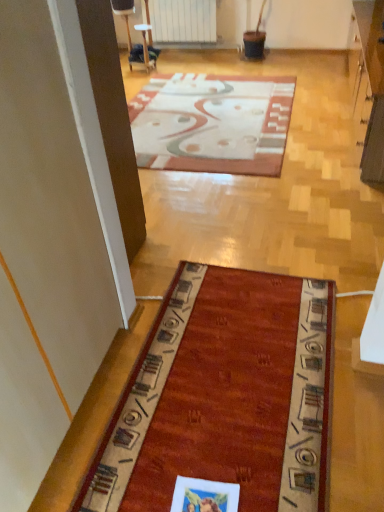
Question: Should I look upward or downward to see patterned carpet at center?

Choices:
 (A) up
 (B) down

Answer: (A)

Question: From a real-world perspective, does white matte radiator at upper center sit lower than patterned carpet at center?

Choices:
 (A) no
 (B) yes

Answer: (A)

Question: Does white matte radiator at upper center contain patterned carpet at center?

Choices:
 (A) yes
 (B) no

Answer: (B)

Question: Is white matte radiator at upper center not near patterned carpet at center?

Choices:
 (A) no
 (B) yes

Answer: (B)

Question: Does white matte radiator at upper center have a lesser height compared to patterned carpet at center?

Choices:
 (A) no
 (B) yes

Answer: (A)

Question: Considering the relative sizes of white matte radiator at upper center and patterned carpet at center in the image provided, is white matte radiator at upper center taller than patterned carpet at center?

Choices:
 (A) yes
 (B) no

Answer: (A)

Question: Does white matte radiator at upper center appear on the right side of patterned carpet at center?

Choices:
 (A) no
 (B) yes

Answer: (A)

Question: Is patterned carpet at center in contact with white matte radiator at upper center?

Choices:
 (A) no
 (B) yes

Answer: (A)

Question: Is patterned carpet at center at the left side of white matte radiator at upper center?

Choices:
 (A) yes
 (B) no

Answer: (B)

Question: Considering the relative sizes of patterned carpet at center and white matte radiator at upper center in the image provided, is patterned carpet at center wider than white matte radiator at upper center?

Choices:
 (A) no
 (B) yes

Answer: (B)

Question: Is patterned carpet at center not close to white matte radiator at upper center?

Choices:
 (A) yes
 (B) no

Answer: (A)

Question: Is patterned carpet at center to the right of white matte radiator at upper center from the viewer's perspective?

Choices:
 (A) no
 (B) yes

Answer: (B)

Question: Is patterned carpet at center smaller than white matte radiator at upper center?

Choices:
 (A) yes
 (B) no

Answer: (B)

Question: From a real-world perspective, is white matte radiator at upper center physically located above or below patterned carpet at center?

Choices:
 (A) below
 (B) above

Answer: (B)